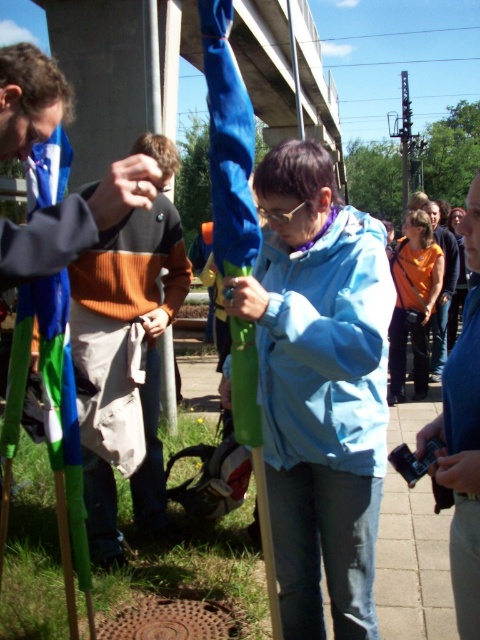
Does light blue fabric jacket at center have a greater height compared to orange fabric at right?

Yes, light blue fabric jacket at center is taller than orange fabric at right.

Is point (357, 410) positioned before point (457, 470)?

No, (357, 410) is further to viewer.

Find the location of a particular element. light blue fabric jacket at center is located at coordinates (320, 387).

Can you confirm if matte black jacket at left is positioned below orange fabric at right?

Incorrect, matte black jacket at left is not positioned below orange fabric at right.

Can you confirm if matte black jacket at left is smaller than orange fabric at right?

Correct, matte black jacket at left occupies less space than orange fabric at right.

I want to click on matte black jacket at left, so click(72, 221).

Is light blue fabric jacket at center bigger than matte black jacket at left?

Actually, light blue fabric jacket at center might be smaller than matte black jacket at left.

Find the location of a particular element. This screenshot has height=640, width=480. light blue fabric jacket at center is located at coordinates pyautogui.click(x=320, y=387).